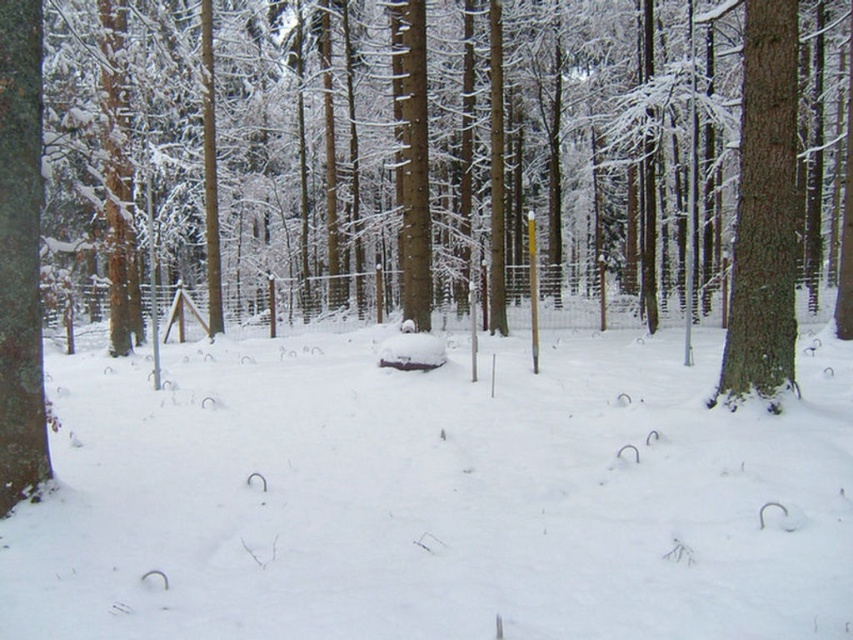
You are a hiker trying to locate the white fluffy snow at center in a winter forest scene. According to the coordinates provided, where would you find it?

The white fluffy snow at center is located at the coordinates point (436, 497).

You are a hiker who wants to place a small flag exactly at the center of the white fluffy snow at center. According to the coordinates provided, where should you place the flag?

The white fluffy snow at center is located at coordinates point [436,497], so you should place the flag at point [436,497].

You are standing in the winter forest scene described. There is a point marked at coordinates [436,497]. What does this point represent?

The point at coordinates [436,497] represents the white fluffy snow at center.